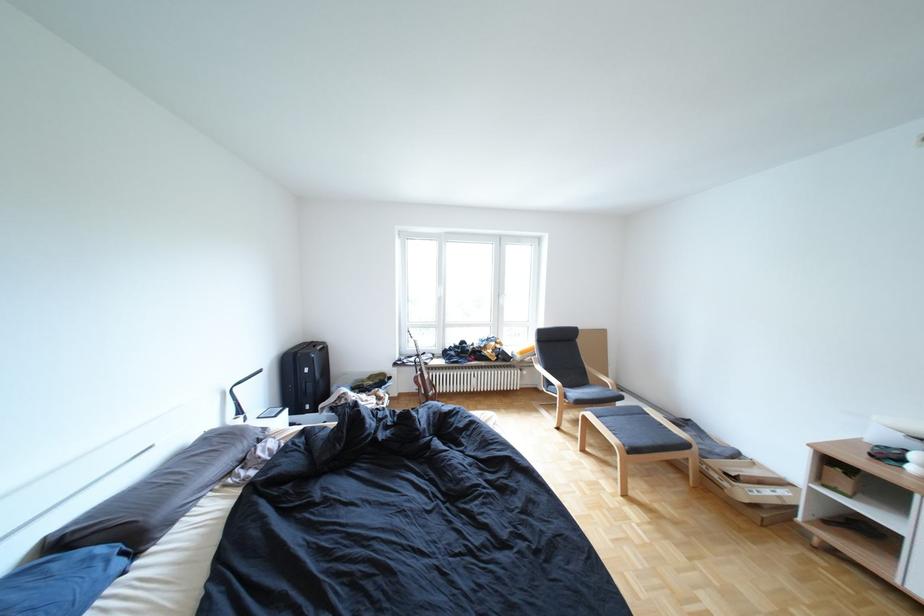
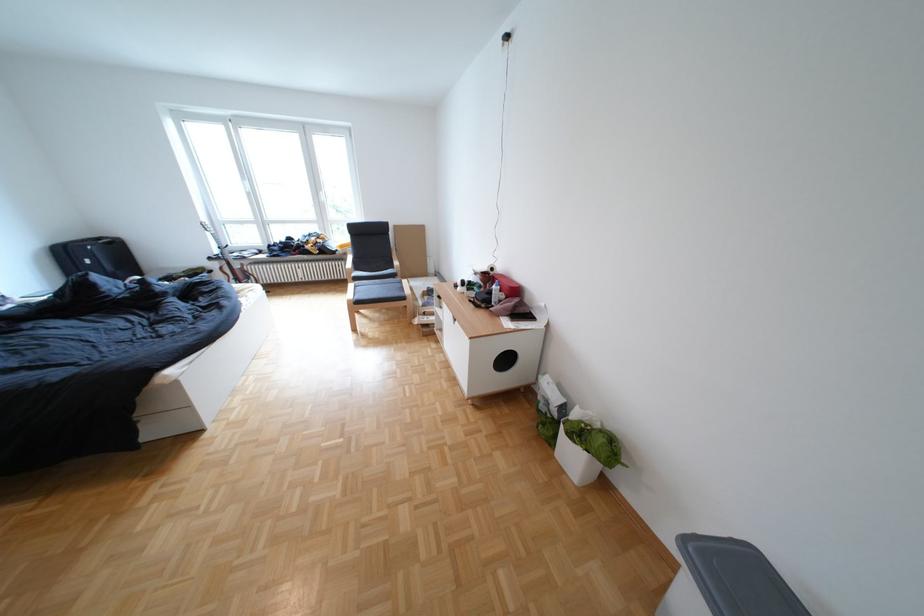
In the second image, find the point that corresponds to point 410,365 in the first image.

(225, 259)